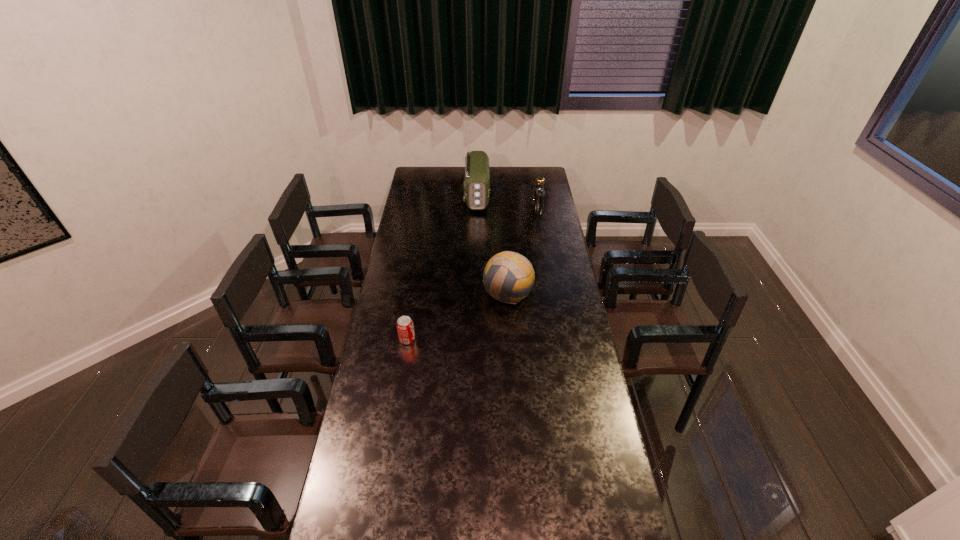
Image resolution: width=960 pixels, height=540 pixels. In order to click on vacant area located on the right of the nearest object in this screenshot , I will do `click(499, 340)`.

Where is `object present at the far edge`? The width and height of the screenshot is (960, 540). object present at the far edge is located at coordinates (477, 177).

The width and height of the screenshot is (960, 540). Identify the location of object that is at the left edge. (405, 328).

You are a GUI agent. You are given a task and a screenshot of the screen. Output one action in this format:
    pyautogui.click(x=<x>, y=<y>)
    Task: Click on the object at the right edge
    The image size is (960, 540).
    Given the screenshot: What is the action you would take?
    pyautogui.click(x=539, y=193)

This screenshot has width=960, height=540. I want to click on free space at the far edge of the desktop, so click(x=450, y=181).

You are a GUI agent. You are given a task and a screenshot of the screen. Output one action in this format:
    pyautogui.click(x=<x>, y=<y>)
    Task: Click on the vacant space at the left edge
    The height and width of the screenshot is (540, 960).
    Given the screenshot: What is the action you would take?
    pyautogui.click(x=377, y=339)

The height and width of the screenshot is (540, 960). Find the location of `vacant area at the right edge of the desktop`. vacant area at the right edge of the desktop is located at coordinates (547, 187).

I want to click on empty location between the radio_receiver and the second nearest object, so click(492, 245).

You are a GUI agent. You are given a task and a screenshot of the screen. Output one action in this format:
    pyautogui.click(x=<x>, y=<y>)
    Task: Click on the free spot between the volleyball and the vodka
    Image resolution: width=960 pixels, height=540 pixels.
    Given the screenshot: What is the action you would take?
    pyautogui.click(x=522, y=252)

Find the location of a particular element. The image size is (960, 540). empty space that is in between the radio_receiver and the volleyball is located at coordinates (492, 245).